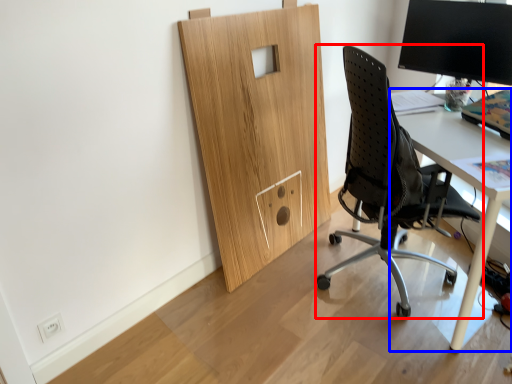
Question: Which of the following is the closest to the observer, chair (highlighted by a red box) or desk (highlighted by a blue box)?

Choices:
 (A) chair
 (B) desk

Answer: (A)